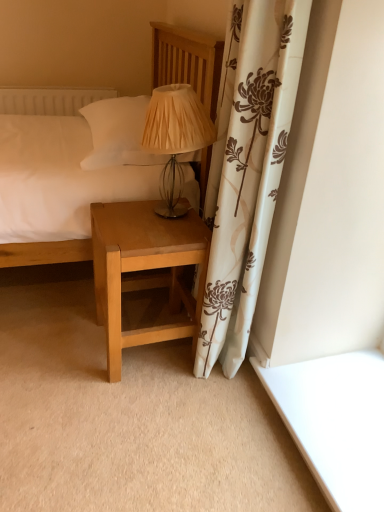
Question: Considering the positions of matte beige fabric lampshade at center and light brown wood nightstand at lower center in the image, is matte beige fabric lampshade at center wider or thinner than light brown wood nightstand at lower center?

Choices:
 (A) wide
 (B) thin

Answer: (B)

Question: From a real-world perspective, is matte beige fabric lampshade at center positioned above or below light brown wood nightstand at lower center?

Choices:
 (A) below
 (B) above

Answer: (B)

Question: Estimate the real-world distances between objects in this image. Which object is farther from the light brown wood nightstand at lower center?

Choices:
 (A) matte beige fabric lampshade at center
 (B) matte wood bed at center

Answer: (B)

Question: Considering the real-world distances, which object is farthest from the light brown wood nightstand at lower center?

Choices:
 (A) matte wood bed at center
 (B) matte beige fabric lampshade at center

Answer: (A)